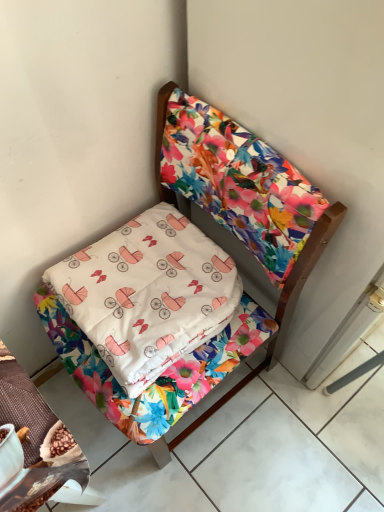
Question: From a real-world perspective, is white cotton pillow at center beneath floral fabric bed at upper right?

Choices:
 (A) yes
 (B) no

Answer: (B)

Question: Is white cotton pillow at center positioned beyond the bounds of floral fabric bed at upper right?

Choices:
 (A) yes
 (B) no

Answer: (B)

Question: From the image's perspective, is white cotton pillow at center on floral fabric bed at upper right?

Choices:
 (A) yes
 (B) no

Answer: (A)

Question: From the image's perspective, would you say white cotton pillow at center is shown under floral fabric bed at upper right?

Choices:
 (A) no
 (B) yes

Answer: (A)

Question: From a real-world perspective, is white cotton pillow at center positioned over floral fabric bed at upper right based on gravity?

Choices:
 (A) no
 (B) yes

Answer: (B)

Question: Can you confirm if white cotton pillow at center is wider than floral fabric bed at upper right?

Choices:
 (A) yes
 (B) no

Answer: (B)

Question: Are floral fabric bed at upper right and white cotton pillow at center beside each other?

Choices:
 (A) no
 (B) yes

Answer: (A)

Question: Does floral fabric bed at upper right have a greater width compared to white cotton pillow at center?

Choices:
 (A) no
 (B) yes

Answer: (B)

Question: Is floral fabric bed at upper right closer to the viewer compared to white cotton pillow at center?

Choices:
 (A) yes
 (B) no

Answer: (A)

Question: Considering the relative sizes of floral fabric bed at upper right and white cotton pillow at center in the image provided, is floral fabric bed at upper right taller than white cotton pillow at center?

Choices:
 (A) yes
 (B) no

Answer: (A)

Question: Is floral fabric bed at upper right oriented away from white cotton pillow at center?

Choices:
 (A) no
 (B) yes

Answer: (B)

Question: Considering the relative positions of floral fabric bed at upper right and white cotton pillow at center in the image provided, is floral fabric bed at upper right behind white cotton pillow at center?

Choices:
 (A) yes
 (B) no

Answer: (B)

Question: In terms of width, does floral fabric bed at upper right look wider or thinner when compared to white cotton pillow at center?

Choices:
 (A) thin
 (B) wide

Answer: (B)